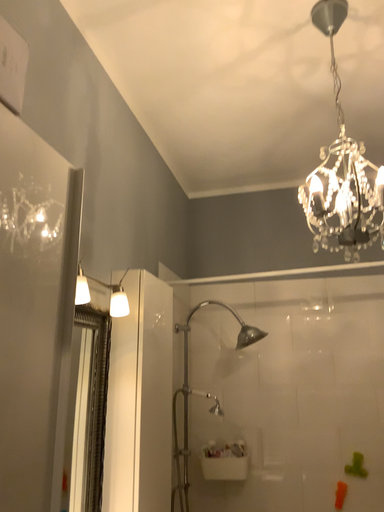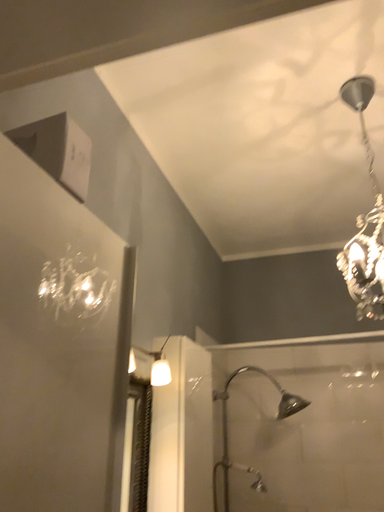
Question: Which way did the camera rotate in the video?

Choices:
 (A) rotated downward
 (B) rotated upward

Answer: (B)